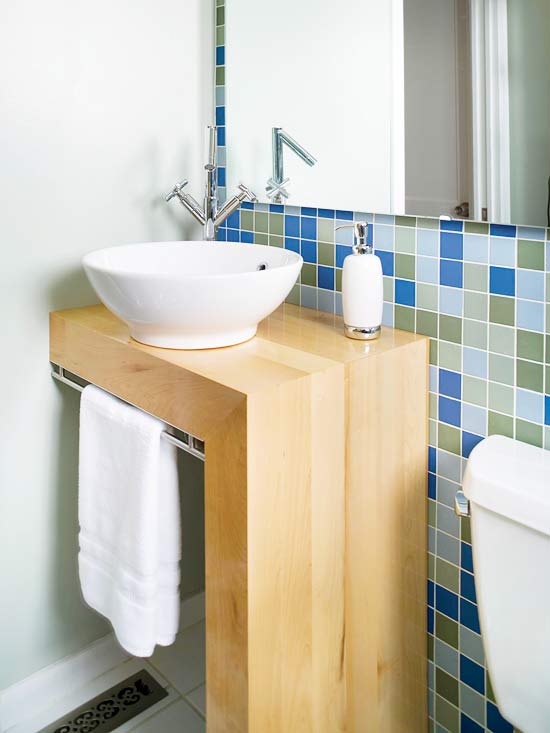
Identify the location of rack. Image resolution: width=550 pixels, height=733 pixels. tap(178, 465).